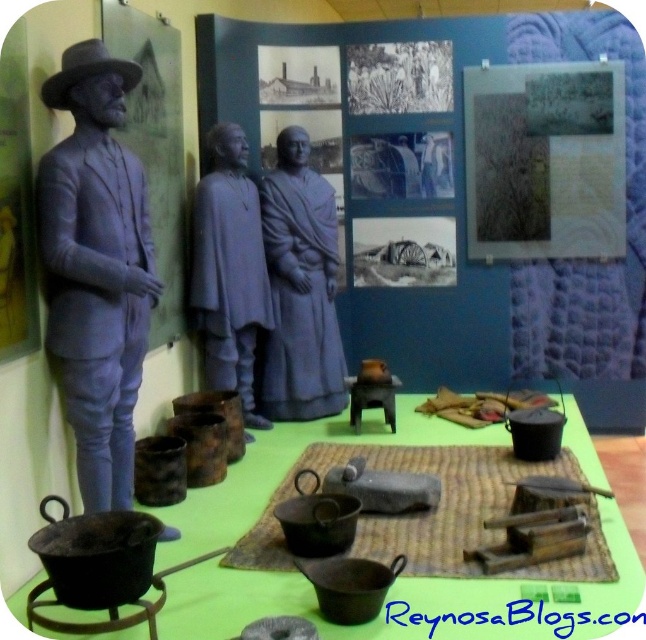
You are a visitor at the museum and want to take a photo of the matte gray statue at left and the gray matte statues at center. Which one should you focus on first if you want to capture both in the same frame without moving your camera?

The matte gray statue at left is located below the gray matte statues at center, so you should focus on the gray matte statues at center first to ensure both are in the frame.

You are a museum curator arranging an exhibit. You need to place a new artifact on the table where the woven mat at center and the gray matte statue at center are located. Where should you place the new artifact to ensure it is visible without blocking the statue?

Place the new artifact on the woven mat at center since it is positioned under the gray matte statue at center, allowing the statue to remain visible while utilizing the mat as a base.